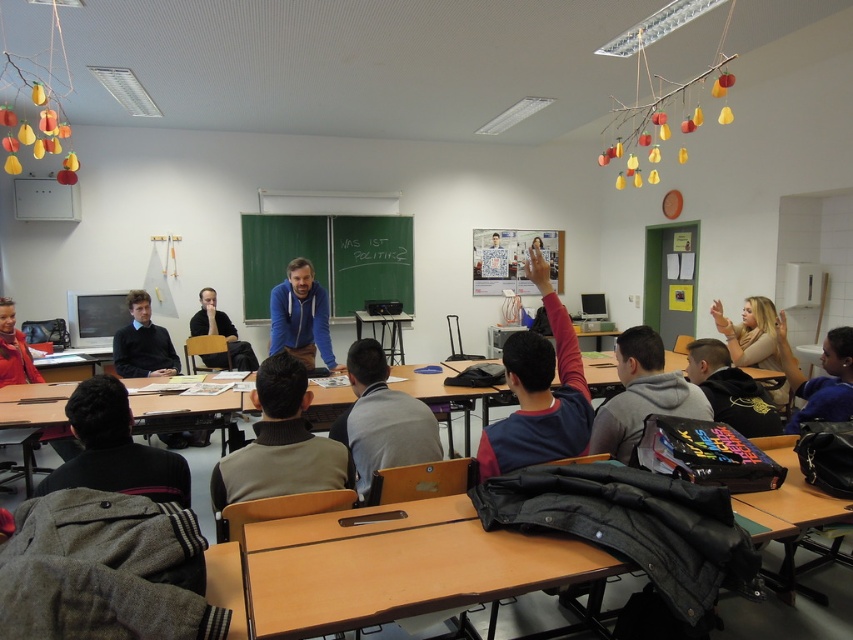
Between point (492, 428) and point (308, 289), which one is positioned behind?

Positioned behind is point (308, 289).

Which is in front, point (479, 451) or point (309, 317)?

Point (479, 451)

Where is `dark blue sweater at center`? Image resolution: width=853 pixels, height=640 pixels. dark blue sweater at center is located at coordinates (538, 392).

Which is behind, point (300, 458) or point (440, 451)?

The point (440, 451) is more distant.

Is light brown sweater at center shorter than gray fabric jacket at center?

Yes, light brown sweater at center is shorter than gray fabric jacket at center.

This screenshot has width=853, height=640. What are the coordinates of `light brown sweater at center` in the screenshot? It's located at click(279, 444).

Is light brown sweater at center thinner than dark gray sweater at lower left?

Correct, light brown sweater at center's width is less than dark gray sweater at lower left's.

Is point (300, 372) less distant than point (131, 454)?

That is False.

Is point (251, 396) more distant than point (129, 410)?

Yes, it is.

This screenshot has width=853, height=640. In order to click on light brown sweater at center in this screenshot , I will do `click(279, 444)`.